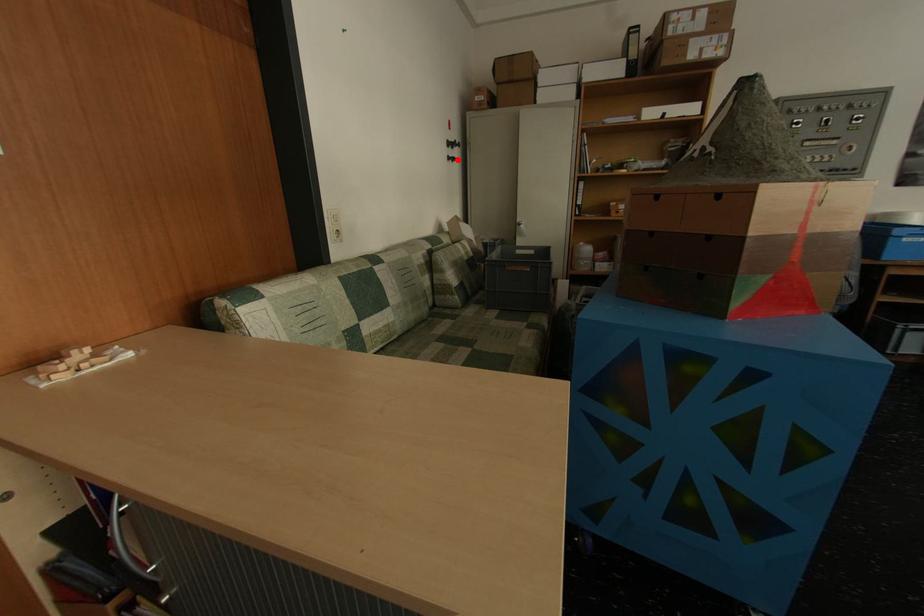
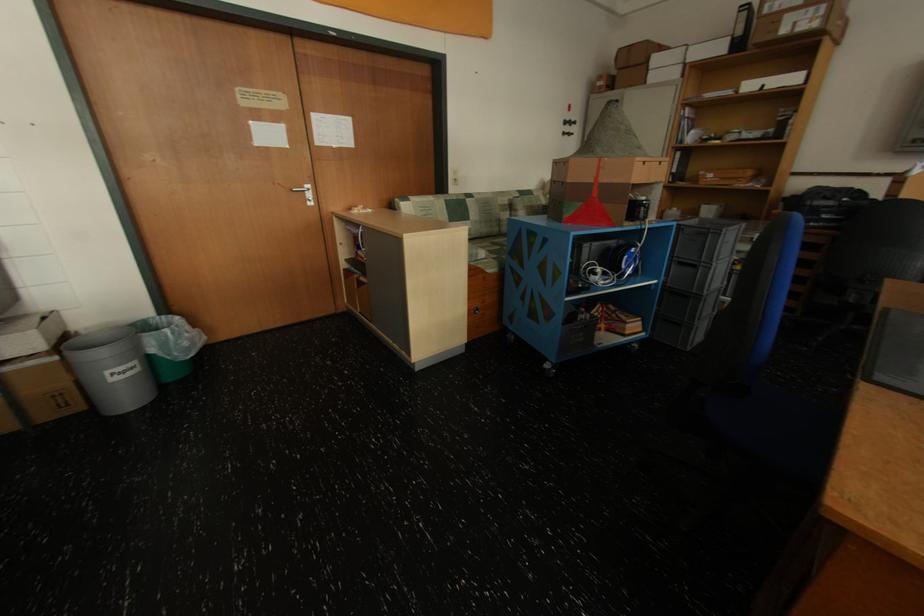
Locate, in the second image, the point that corresponds to the highlighted location in the first image.

(573, 135)